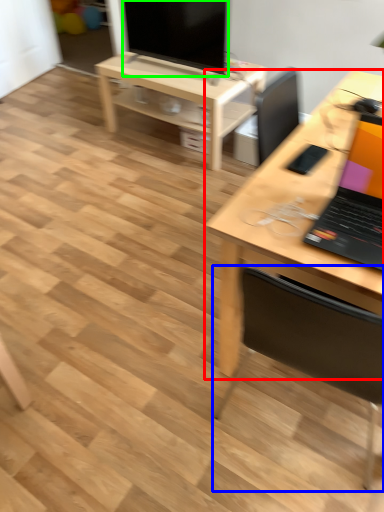
Question: Considering the real-world distances, which object is closest to desk (highlighted by a red box)? chair (highlighted by a blue box) or television (highlighted by a green box).

Choices:
 (A) chair
 (B) television

Answer: (A)